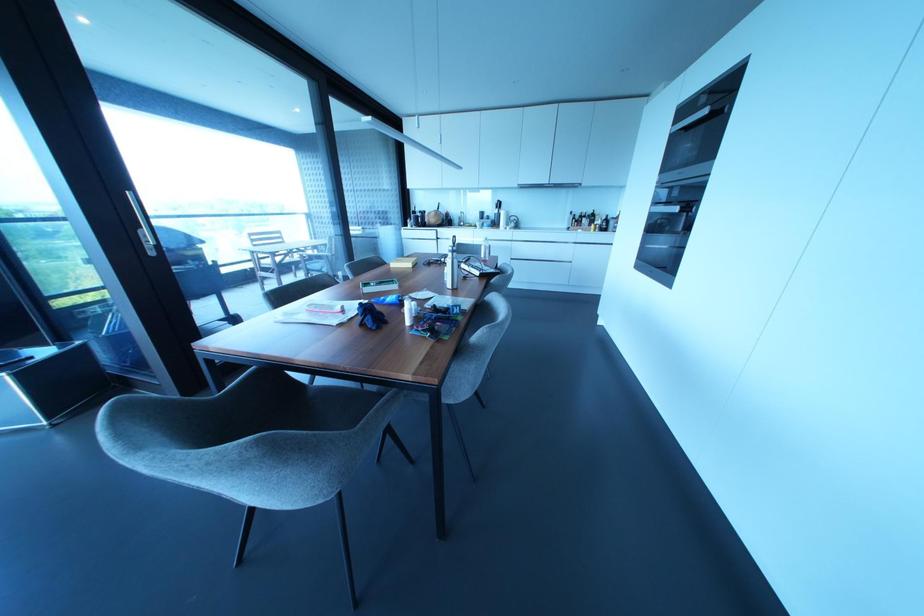
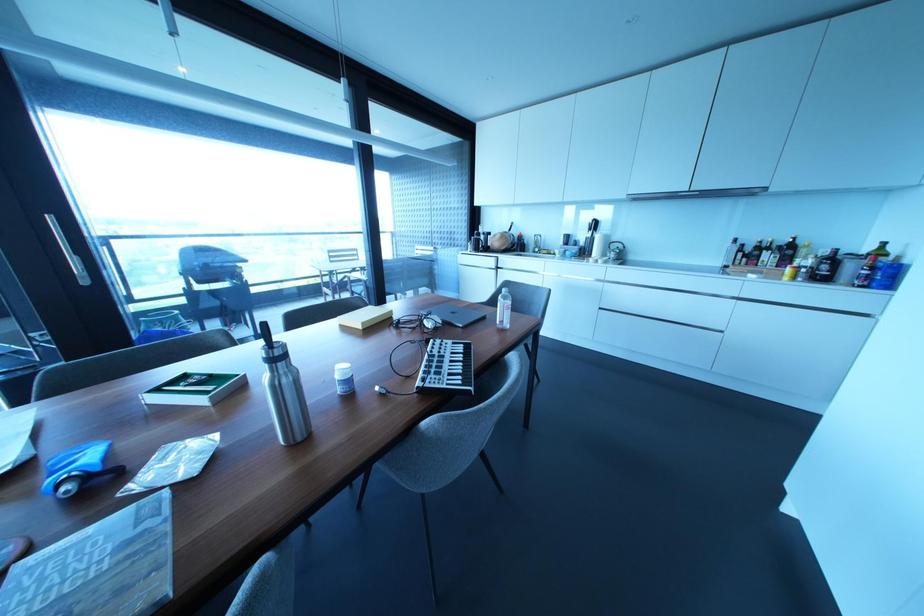
In the second image, find the point that corresponds to [605,219] in the first image.

(833, 257)